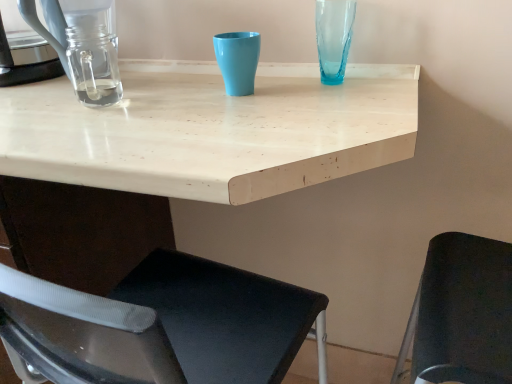
Question: Looking at the image, does clear glass jar at left seem bigger or smaller compared to clear glass coffeepot at left?

Choices:
 (A) big
 (B) small

Answer: (A)

Question: Do you think clear glass jar at left is within clear glass coffeepot at left, or outside of it?

Choices:
 (A) inside
 (B) outside

Answer: (B)

Question: Estimate the real-world distances between objects in this image. Which object is farther from the matte plastic cup at center?

Choices:
 (A) translucent blue glass vase at upper right
 (B) clear glass jar at left
 (C) black fabric chair at lower right
 (D) clear glass coffeepot at left
 (E) white matte table at center

Answer: (C)

Question: Based on their relative distances, which object is farther from the clear glass jar at left?

Choices:
 (A) matte plastic cup at center
 (B) clear glass coffeepot at left
 (C) white matte table at center
 (D) black fabric chair at lower right
 (E) translucent blue glass vase at upper right

Answer: (D)